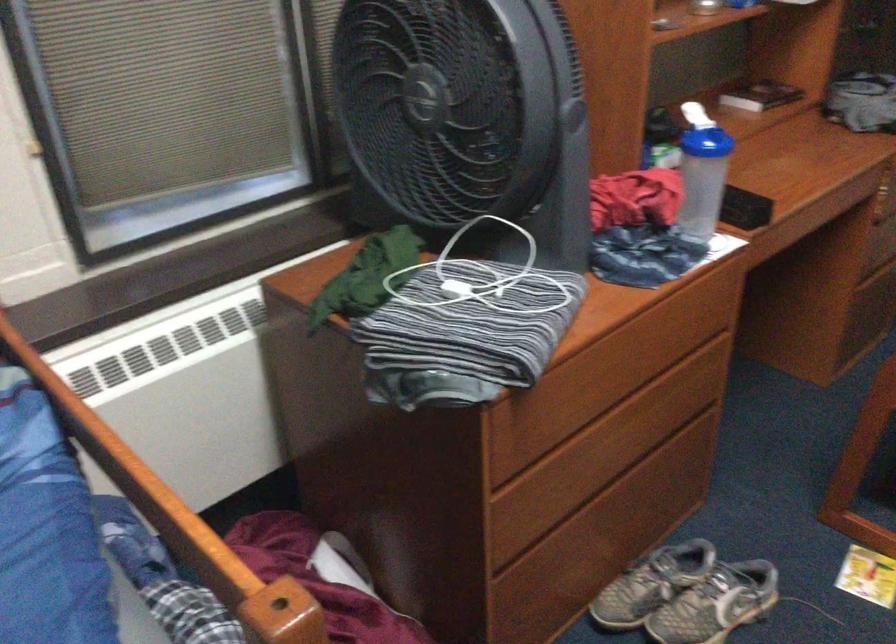
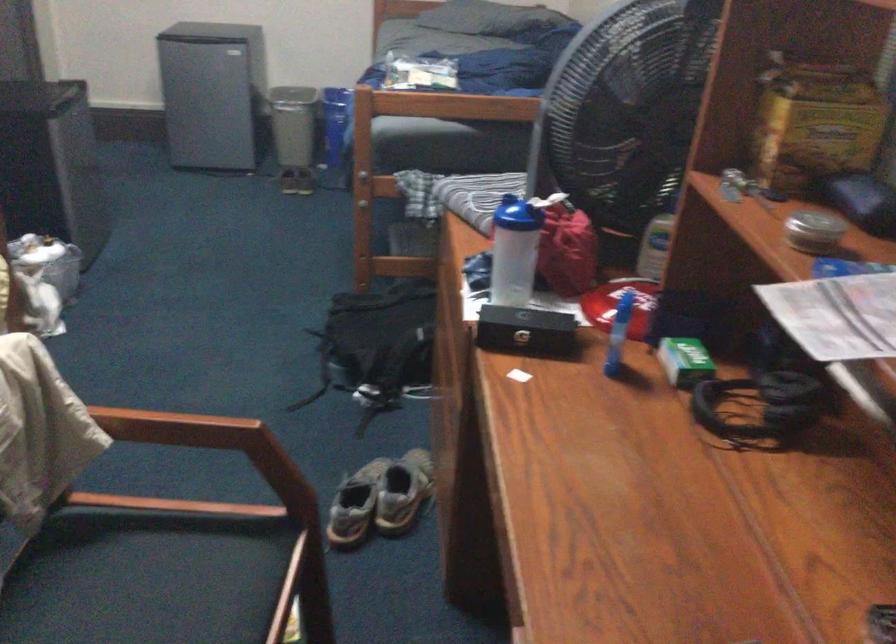
Where in the second image is the point corresponding to [660,124] from the first image?

(767, 397)